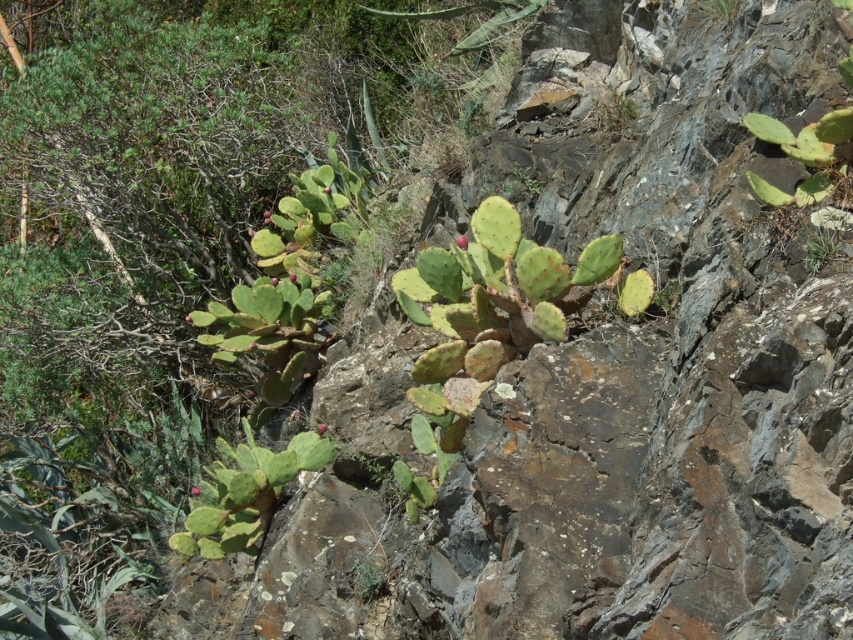
You are navigating through the rocky terrain and want to reach a specific location. You have two points marked on your map labeled as point (221, 502) and point (828, 230). According to the scene description, which point is farther away from you?

Point (221, 502) is behind point (828, 230), so point (221, 502) is farther away from you.

You are a hiker who wants to navigate from the green spiny cactus at lower left to the green spiny cactus at upper right. Which direction should you move to reach it?

You should move upward to reach the green spiny cactus at upper right from the green spiny cactus at lower left because the green spiny cactus at lower left is located below it.

You are a hiker standing at the camera position looking at the rocky terrain. You want to pick a fruit from the green spiny cactus at lower left. Can you reach it without moving closer than 9 meters?

The green spiny cactus at lower left is 9.12 meters away from the camera. Since you need to stay at least 9 meters away, you are 0.12 meters too far to reach it without moving closer.